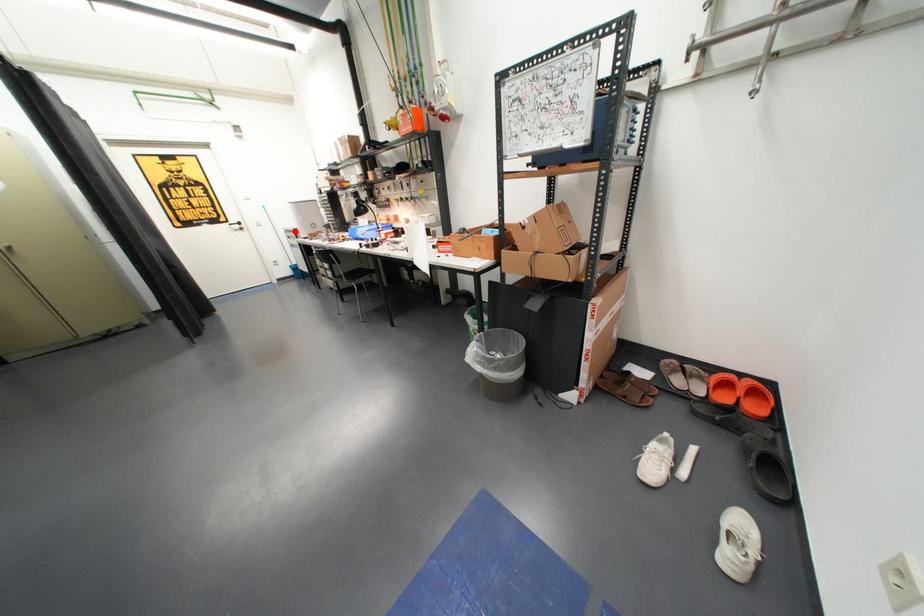
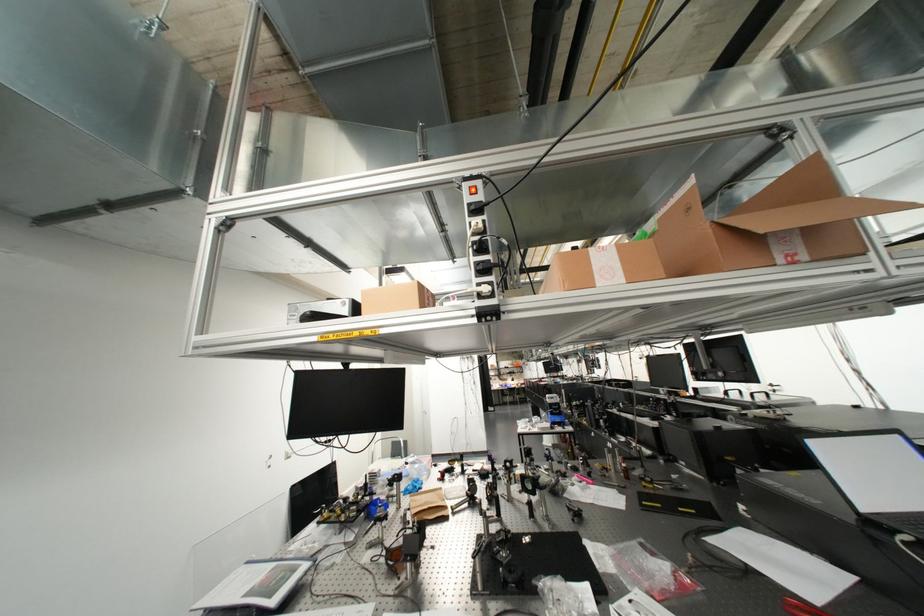
Question: I am providing you with two images of the same scene from different viewpoints. A red point is marked on the first image. At the location where the point appears in image 1, is it still visible in image 2?

Choices:
 (A) Yes
 (B) No

Answer: (B)